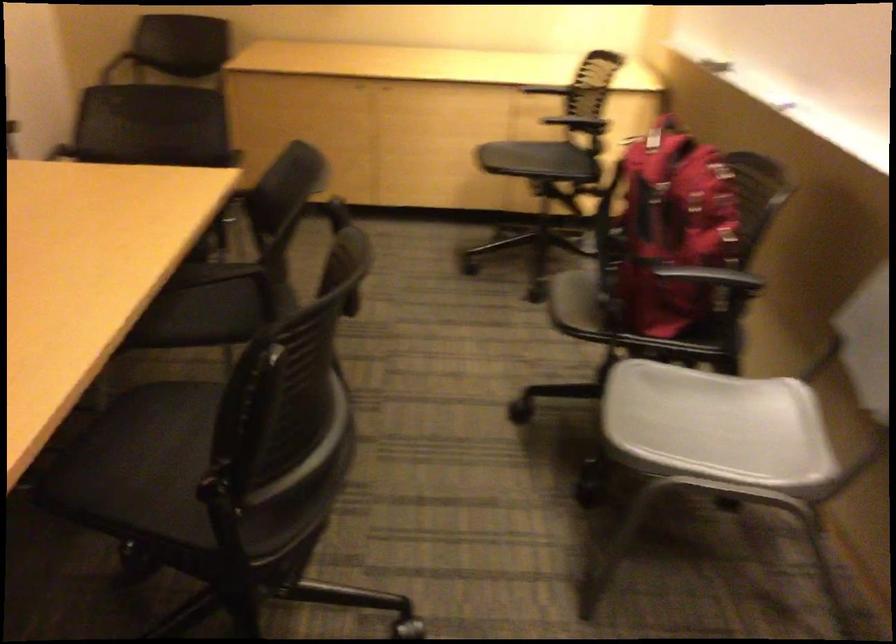
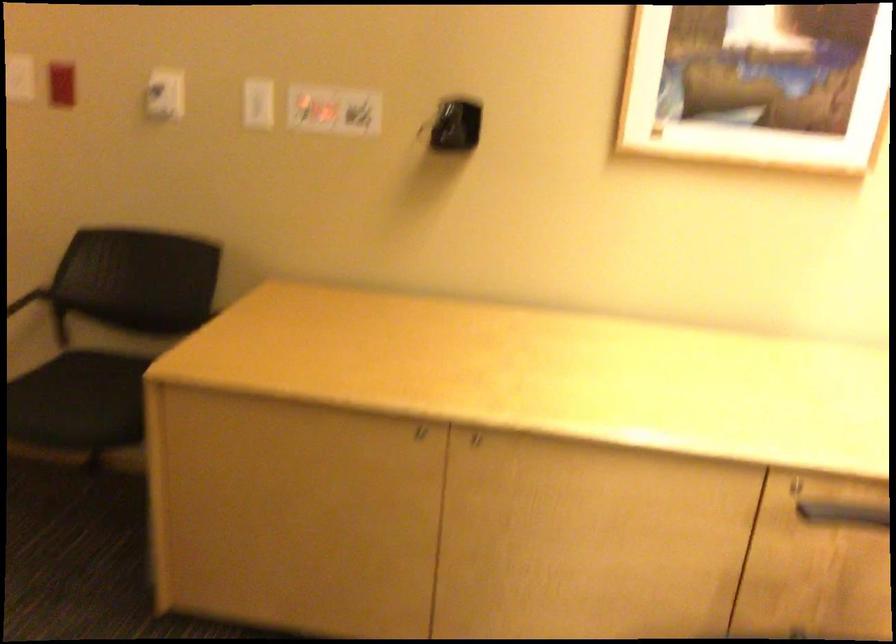
The point at (x=348, y=80) is marked in the first image. Where is the corresponding point in the second image?

(410, 433)